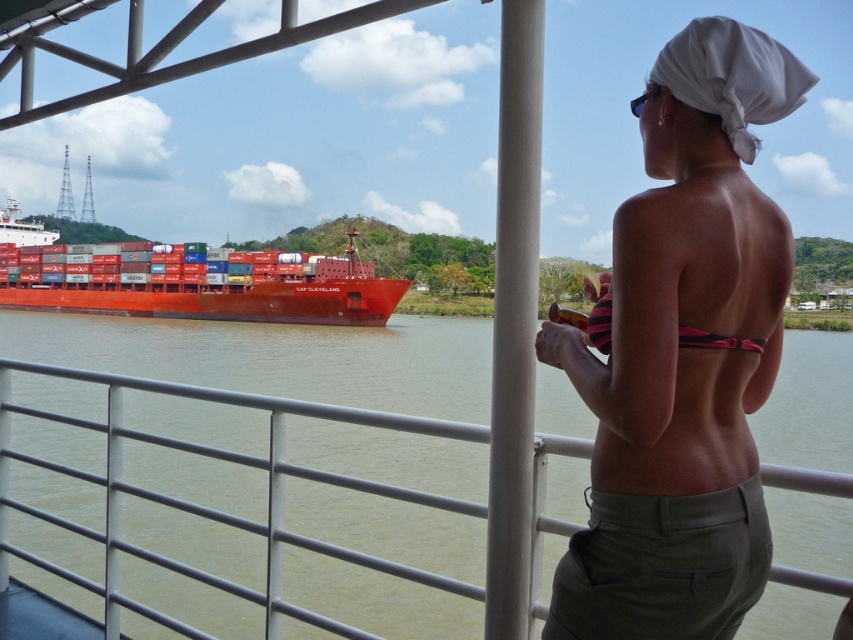
Is pink fabric bikini at center to the right of pink striped bikini top at back from the viewer's perspective?

Correct, you'll find pink fabric bikini at center to the right of pink striped bikini top at back.

Is pink fabric bikini at center thinner than pink striped bikini top at back?

In fact, pink fabric bikini at center might be wider than pink striped bikini top at back.

The width and height of the screenshot is (853, 640). I want to click on pink fabric bikini at center, so click(x=682, y=355).

Does pink fabric bikini at center appear over matte red container ship at left?

No, pink fabric bikini at center is not above matte red container ship at left.

What do you see at coordinates (682, 355) in the screenshot? I see `pink fabric bikini at center` at bounding box center [682, 355].

Locate an element on the screen. Image resolution: width=853 pixels, height=640 pixels. pink fabric bikini at center is located at coordinates click(x=682, y=355).

Between matte red container ship at left and pink striped bikini top at back, which one is positioned lower?

pink striped bikini top at back is below.

Is matte red container ship at left in front of pink striped bikini top at back?

No, it is not.

Find the location of a particular element. matte red container ship at left is located at coordinates (198, 284).